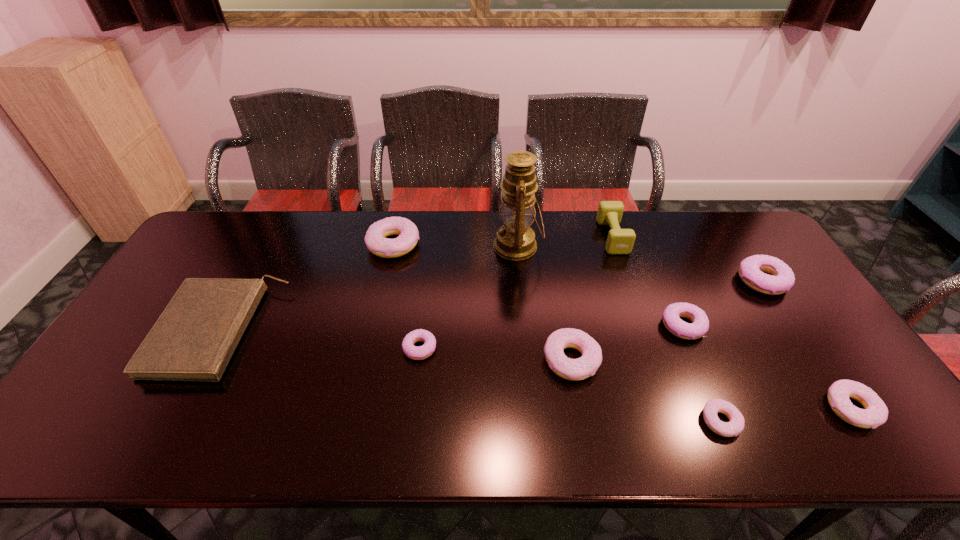
Select which purple doughnut is the closest to the leftmost pink doughnut. Please provide its 2D coordinates. Your answer should be formatted as a tuple, i.e. [(x, y)], where the tuple contains the x and y coordinates of a point satisfying the conditions above.

[(422, 352)]

This screenshot has height=540, width=960. Identify the location of vacant space that satisfies the following two spatial constraints: 1. on the front side of the farthest pink doughnut; 2. on the spine side of the leftmost object. (374, 330).

What are the coordinates of `vacant space that satisfies the following two spatial constraints: 1. on the front side of the oil lamp; 2. on the right side of the second pink doughnut from right to left` in the screenshot? It's located at [x=534, y=421].

You are a GUI agent. You are given a task and a screenshot of the screen. Output one action in this format:
    pyautogui.click(x=<x>, y=<y>)
    Task: Click on the free spot that satisfies the following two spatial constraints: 1. on the back side of the olive dumbbell; 2. on the right side of the third smallest pink doughnut
    This screenshot has width=960, height=540.
    Given the screenshot: What is the action you would take?
    pyautogui.click(x=549, y=237)